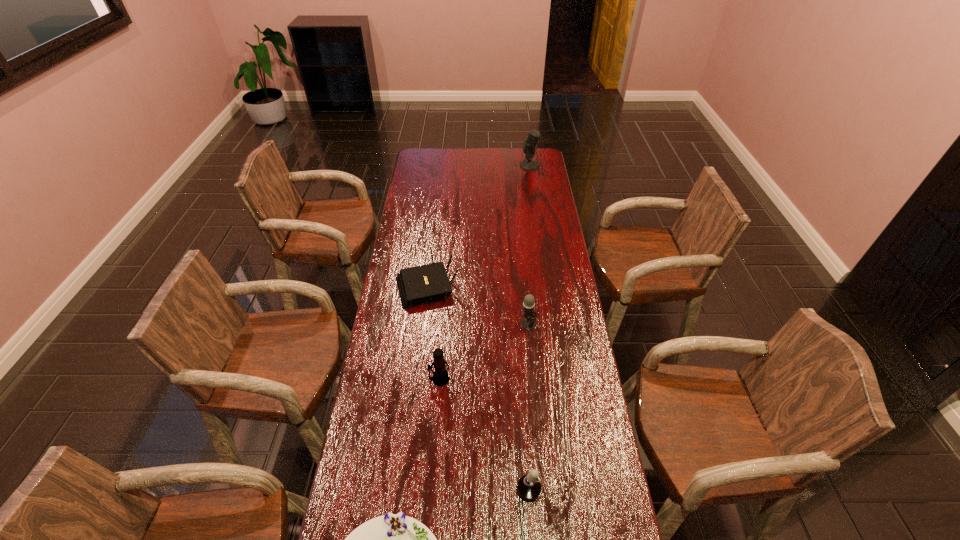
Locate an element on the screen. free spot located 0.050m on the left of the fourth nearest object is located at coordinates (507, 323).

At what (x,y) coordinates should I click in order to perform the action: click on free space located on the back of the shortest microphone. Please return your answer as a coordinate pair (x, y). The width and height of the screenshot is (960, 540). Looking at the image, I should click on (533, 364).

Image resolution: width=960 pixels, height=540 pixels. Find the location of `free space located on the front of the fifth nearest object`. free space located on the front of the fifth nearest object is located at coordinates (415, 387).

Find the location of `object present at the far edge`. object present at the far edge is located at coordinates (529, 145).

Locate an element on the screen. object that is at the left edge is located at coordinates (419, 285).

What are the coordinates of `object at the far right corner` in the screenshot? It's located at (529, 145).

Identify the location of vacant region at the left edge of the desktop. The height and width of the screenshot is (540, 960). (392, 414).

The height and width of the screenshot is (540, 960). In the image, there is a desktop. Identify the location of vacant space at the right edge. (554, 250).

In order to click on vacant space at the far left corner in this screenshot , I will do `click(427, 152)`.

This screenshot has width=960, height=540. Identify the location of empty location between the fifth nearest object and the third nearest microphone. (478, 305).